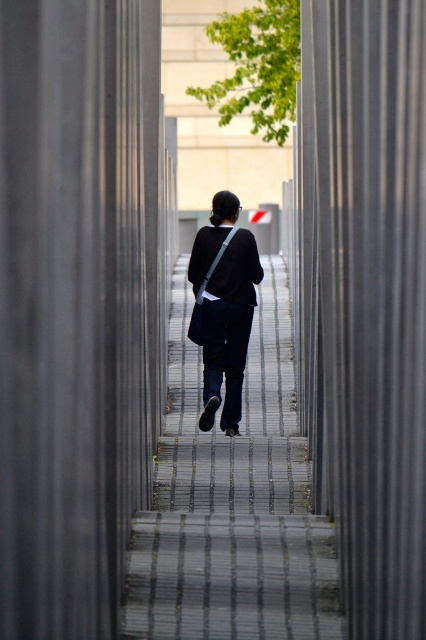
You are a fashion designer observing a person wearing dark blue jeans at center and matte black jacket at center. Which clothing item takes up more visual space in the image?

The dark blue jeans at center takes up more visual space in the image because it is bigger than the matte black jacket at center.

You are a security camera monitoring the area. The person wearing dark blue jeans at center is walking away from you. Based on their position coordinates, can you determine if they are moving towards the pillars on the left or the right side of the path?

The dark blue jeans at center is located at point (233,502). Since the coordinate system typically has (0,0) at the bottom left corner, a higher x value means moving right. Therefore, the person is moving towards the right side pillars.